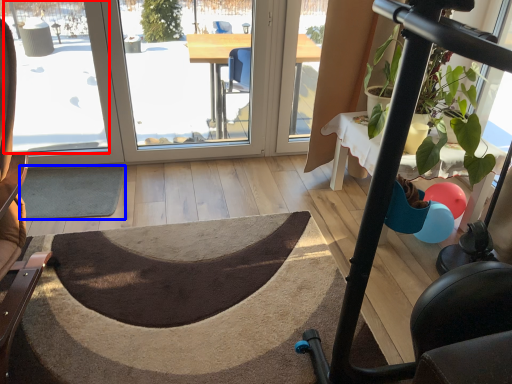
Question: Which point is closer to the camera, window screen (highlighted by a red box) or doormat (highlighted by a blue box)?

Choices:
 (A) window screen
 (B) doormat

Answer: (A)